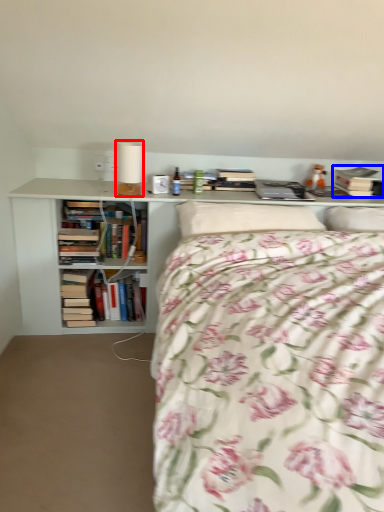
Question: Which object is further to the camera taking this photo, table lamp (highlighted by a red box) or book (highlighted by a blue box)?

Choices:
 (A) table lamp
 (B) book

Answer: (B)